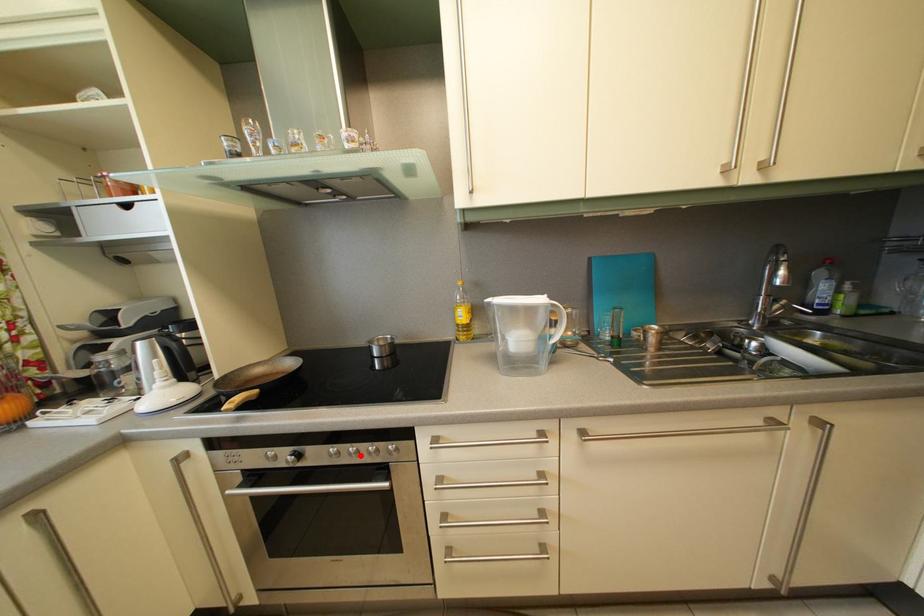
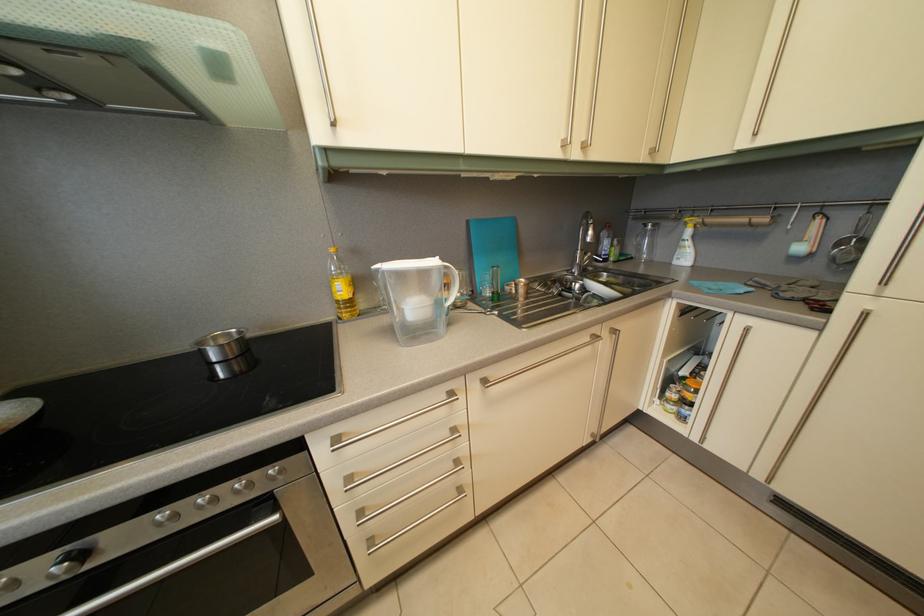
Question: I am providing you with two images of the same scene from different viewpoints. Given a red point in image1, look at the same physical point in image2. Is it:

Choices:
 (A) Closer to the viewpoint
 (B) Farther from the viewpoint

Answer: (A)